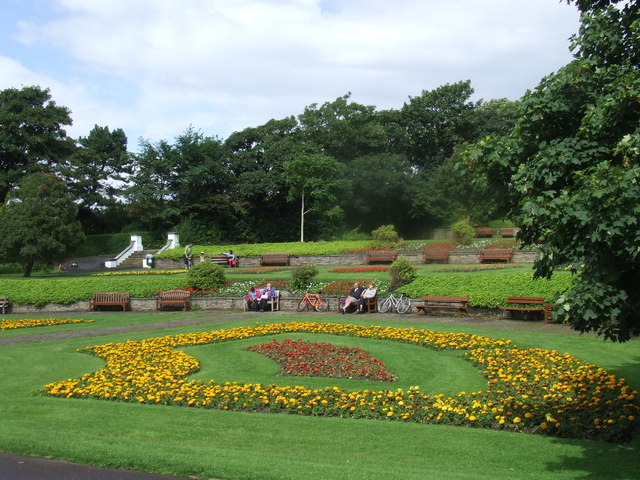
Identify the location of stairs. Image resolution: width=640 pixels, height=480 pixels. (137, 256).